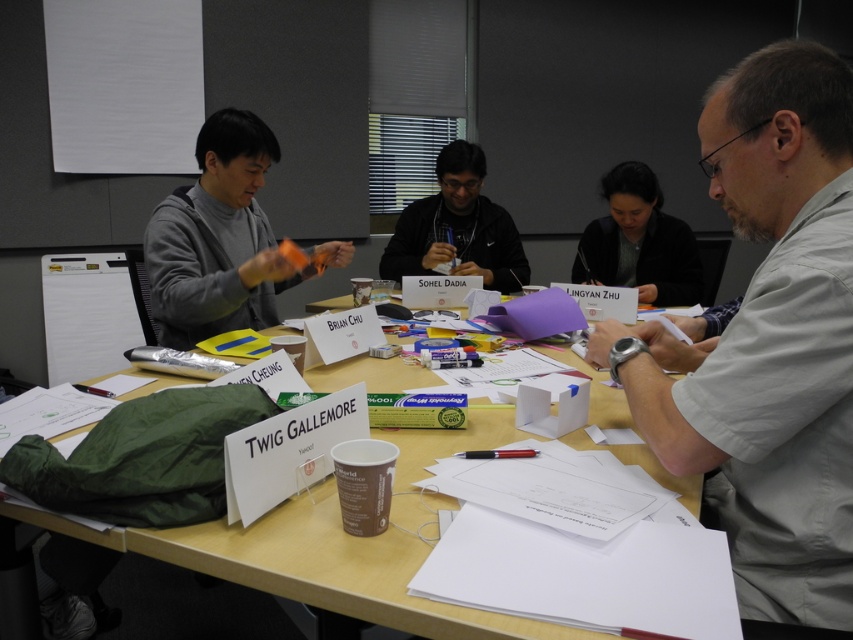
You are sitting at the rectangular table in the conference room and notice the matte orange plastic at center and the dark gray sweater at center. Which object is positioned lower relative to the other?

The matte orange plastic at center is located below the dark gray sweater at center, so it is positioned lower.

You are organizing a small gathering and need to place a 1.2 meter wide decorative mat on the wooden table at center. Can the dark gray sweater at center currently on the table fit on the mat without moving anything else?

The wooden table at center is bigger than the dark gray sweater at center. Since the table is larger, the sweater can fit on the mat as long as the mat is placed appropriately, but the exact dimensions aren